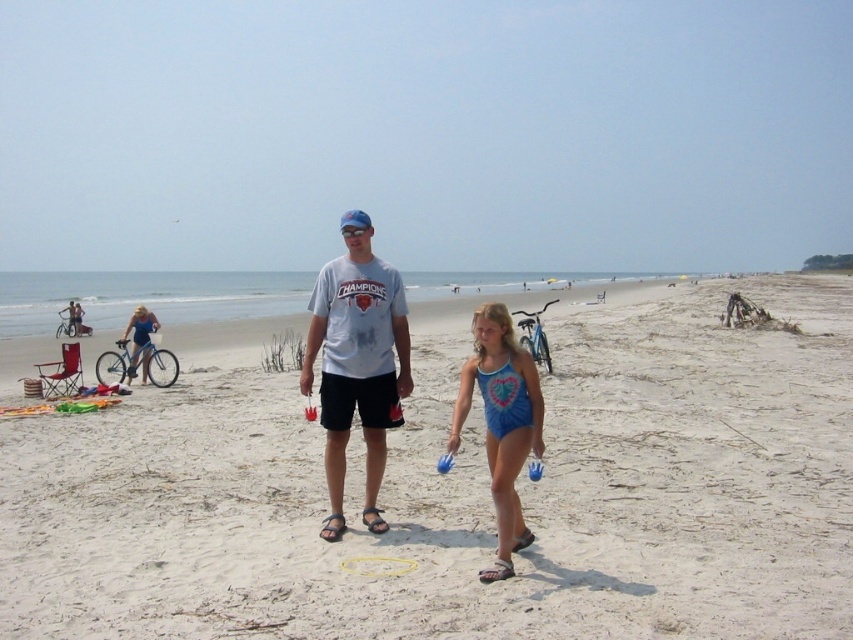
Consider the image. Can you confirm if white sandy beach at center is taller than black rubber sandal at center?

Yes, white sandy beach at center is taller than black rubber sandal at center.

Is white sandy beach at center further to camera compared to black rubber sandal at center?

That is False.

Where is `white sandy beach at center`? white sandy beach at center is located at coordinates (465, 493).

Measure the distance between white sandy beach at center and camera.

They are 14.95 feet apart.

Between white sandy beach at center and blue swimsuit at center, which one appears on the left side from the viewer's perspective?

Positioned to the left is blue swimsuit at center.

Who is more distant from viewer, [686,499] or [456,401]?

Point [456,401]

Identify the location of white sandy beach at center. (465, 493).

What do you see at coordinates (465, 493) in the screenshot? I see `white sandy beach at center` at bounding box center [465, 493].

Which is behind, point (3, 456) or point (494, 580)?

Point (3, 456)

Image resolution: width=853 pixels, height=640 pixels. I want to click on white sandy beach at center, so click(465, 493).